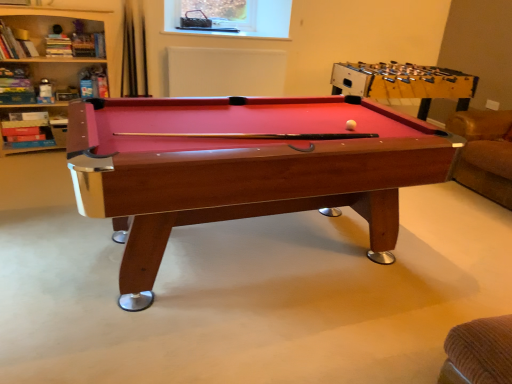
Question: Does rubberized red pool table at upper right have a greater width compared to wooden billiard table at center?

Choices:
 (A) yes
 (B) no

Answer: (A)

Question: From the image's perspective, is rubberized red pool table at upper right on wooden billiard table at center?

Choices:
 (A) yes
 (B) no

Answer: (A)

Question: From a real-world perspective, is rubberized red pool table at upper right beneath wooden billiard table at center?

Choices:
 (A) yes
 (B) no

Answer: (B)

Question: Is wooden billiard table at center at the back of rubberized red pool table at upper right?

Choices:
 (A) yes
 (B) no

Answer: (B)

Question: Is rubberized red pool table at upper right outside wooden billiard table at center?

Choices:
 (A) no
 (B) yes

Answer: (B)

Question: From the image's perspective, relative to rubberized red pool table at upper right, is yellow matte ball at center above or below?

Choices:
 (A) below
 (B) above

Answer: (A)

Question: From a real-world perspective, relative to rubberized red pool table at upper right, is yellow matte ball at center vertically above or below?

Choices:
 (A) below
 (B) above

Answer: (B)

Question: From their relative heights in the image, would you say yellow matte ball at center is taller or shorter than rubberized red pool table at upper right?

Choices:
 (A) tall
 (B) short

Answer: (B)

Question: In terms of width, does yellow matte ball at center look wider or thinner when compared to rubberized red pool table at upper right?

Choices:
 (A) wide
 (B) thin

Answer: (B)

Question: Looking at their shapes, would you say wooden billiard table at center is wider or thinner than rubberized red pool table at upper right?

Choices:
 (A) thin
 (B) wide

Answer: (A)

Question: Considering the relative positions of wooden billiard table at center and rubberized red pool table at upper right in the image provided, is wooden billiard table at center to the left or to the right of rubberized red pool table at upper right?

Choices:
 (A) left
 (B) right

Answer: (A)

Question: In terms of height, does wooden billiard table at center look taller or shorter compared to rubberized red pool table at upper right?

Choices:
 (A) tall
 (B) short

Answer: (A)

Question: From a real-world perspective, is wooden billiard table at center above or below rubberized red pool table at upper right?

Choices:
 (A) below
 (B) above

Answer: (A)

Question: Is yellow matte ball at center bigger or smaller than wooden bookshelf at upper left?

Choices:
 (A) small
 (B) big

Answer: (A)

Question: From the image's perspective, relative to wooden bookshelf at upper left, is yellow matte ball at center above or below?

Choices:
 (A) below
 (B) above

Answer: (A)